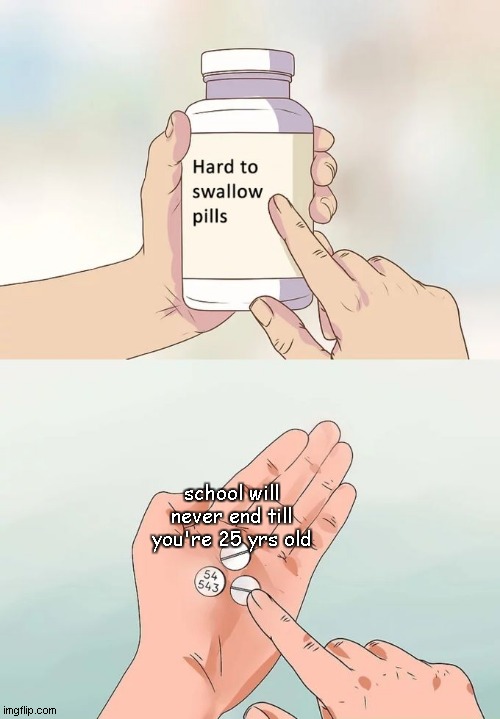
Where is `pill bottle lid`? pill bottle lid is located at coordinates (247, 65).